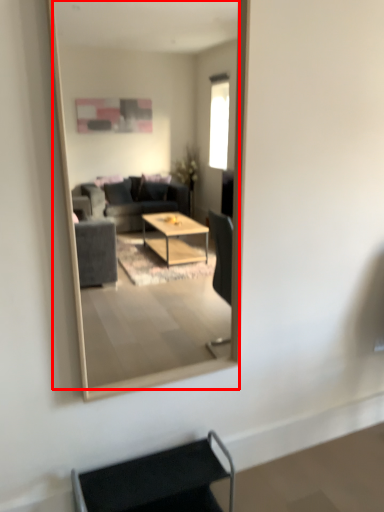
Question: From the image's perspective, what is the correct spatial relationship of mirror (annotated by the red box) in relation to armchair?

Choices:
 (A) below
 (B) above

Answer: (B)